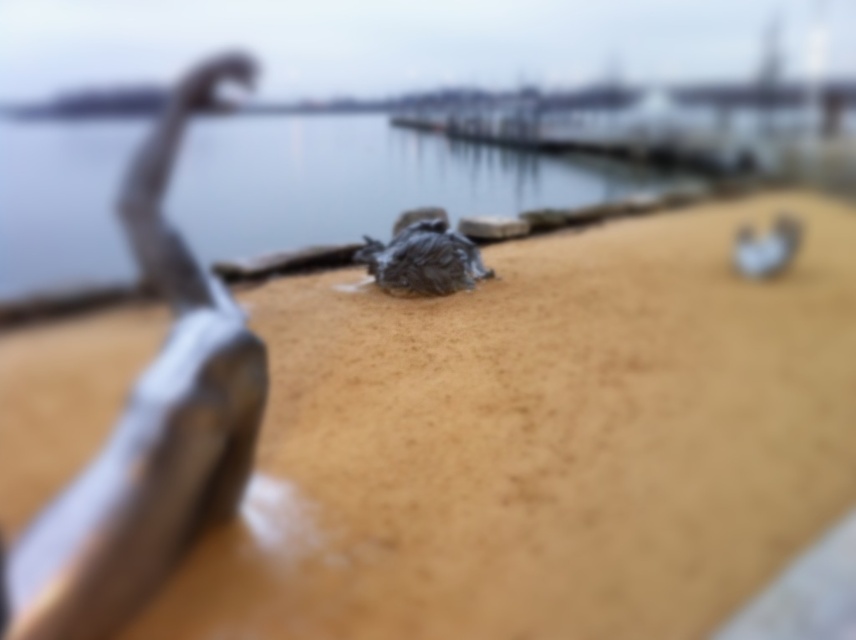
Based on the photo, does brown matte sand at center appear on the left side of metallic silver sculpture at left?

Incorrect, brown matte sand at center is not on the left side of metallic silver sculpture at left.

Can you confirm if brown matte sand at center is wider than metallic silver sculpture at left?

Correct, the width of brown matte sand at center exceeds that of metallic silver sculpture at left.

Is point (304, 442) behind point (177, 116)?

No.

Locate an element on the screen. The width and height of the screenshot is (856, 640). brown matte sand at center is located at coordinates (539, 440).

Between brown matte sand at center and clear water at center, which one is positioned higher?

clear water at center is above.

Is brown matte sand at center shorter than clear water at center?

Correct, brown matte sand at center is not as tall as clear water at center.

The image size is (856, 640). Find the location of `brown matte sand at center`. brown matte sand at center is located at coordinates (539, 440).

Find the location of a particular element. The height and width of the screenshot is (640, 856). brown matte sand at center is located at coordinates (539, 440).

Does point (355, 236) come in front of point (229, 486)?

No.

From the picture: Can you confirm if clear water at center is smaller than metallic silver sculpture at left?

No.

Which is behind, point (295, 131) or point (195, 276)?

Point (295, 131)

Identify the location of clear water at center. (360, 180).